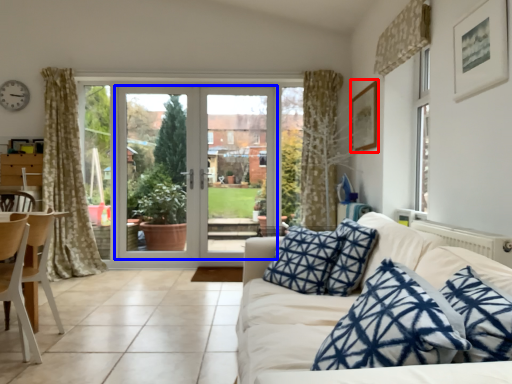
Question: Among these objects, which one is farthest to the camera, picture frame (highlighted by a red box) or door (highlighted by a blue box)?

Choices:
 (A) picture frame
 (B) door

Answer: (B)